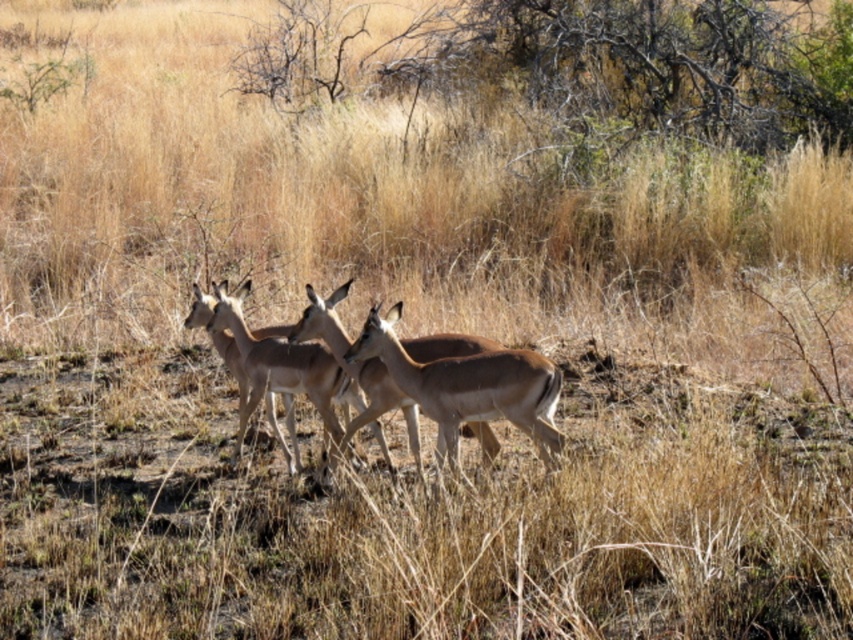
Is brown glossy antelope at center shorter than brown fur antelope at center?

Incorrect, brown glossy antelope at center's height does not fall short of brown fur antelope at center's.

Who is higher up, brown glossy antelope at center or brown fur antelope at center?

brown glossy antelope at center is higher up.

Does point (212, 289) come closer to viewer compared to point (257, 394)?

No.

What are the coordinates of `brown glossy antelope at center` in the screenshot? It's located at (293, 364).

Can you confirm if brown glossy antelope at center is positioned above brown matte deer at center?

Yes.

What do you see at coordinates (293, 364) in the screenshot? I see `brown glossy antelope at center` at bounding box center [293, 364].

The height and width of the screenshot is (640, 853). What are the coordinates of `brown glossy antelope at center` in the screenshot? It's located at (293, 364).

Which is above, brown matte deer at center or brown fur antelope at center?

brown matte deer at center

Between brown matte deer at center and brown fur antelope at center, which one appears on the left side from the viewer's perspective?

Positioned to the left is brown fur antelope at center.

Find the location of a particular element. brown matte deer at center is located at coordinates (468, 387).